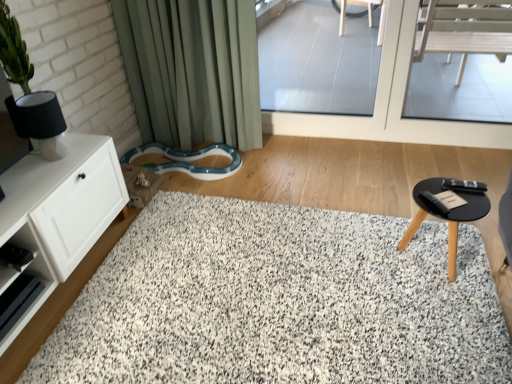
Question: Is white shaggy rug at center aimed at transparent glass door at upper center, the 2th window screen from the right?

Choices:
 (A) yes
 (B) no

Answer: (B)

Question: From the image's perspective, is white shaggy rug at center below transparent glass door at upper center, which appears as the 1th window screen when viewed from the left?

Choices:
 (A) no
 (B) yes

Answer: (B)

Question: Does white shaggy rug at center have a larger size compared to transparent glass door at upper center, the 2th window screen from the right?

Choices:
 (A) no
 (B) yes

Answer: (B)

Question: Can you confirm if white shaggy rug at center is shorter than transparent glass door at upper center, which appears as the 1th window screen when viewed from the left?

Choices:
 (A) yes
 (B) no

Answer: (A)

Question: Is transparent glass door at upper center, which appears as the 1th window screen when viewed from the left, inside white shaggy rug at center?

Choices:
 (A) no
 (B) yes

Answer: (A)

Question: In terms of size, does black matte table at lower right appear bigger or smaller than transparent glass window at center, which appears as the first window screen when viewed from the right?

Choices:
 (A) big
 (B) small

Answer: (B)

Question: From the image's perspective, is black matte table at lower right above or below transparent glass window at center, which appears as the first window screen when viewed from the right?

Choices:
 (A) above
 (B) below

Answer: (B)

Question: From their relative heights in the image, would you say black matte table at lower right is taller or shorter than transparent glass window at center, which appears as the first window screen when viewed from the right?

Choices:
 (A) tall
 (B) short

Answer: (B)

Question: Relative to transparent glass window at center, arranged as the 2th window screen when viewed from the left, is black matte table at lower right in front or behind?

Choices:
 (A) front
 (B) behind

Answer: (A)

Question: Is transparent glass door at upper center, the 2th window screen from the right, bigger or smaller than green fabric curtain at upper left?

Choices:
 (A) small
 (B) big

Answer: (A)

Question: Do you think transparent glass door at upper center, the 2th window screen from the right, is within green fabric curtain at upper left, or outside of it?

Choices:
 (A) outside
 (B) inside

Answer: (A)

Question: Based on their positions, is transparent glass door at upper center, the 2th window screen from the right, located to the left or right of green fabric curtain at upper left?

Choices:
 (A) left
 (B) right

Answer: (B)

Question: From the image's perspective, is transparent glass door at upper center, which appears as the 1th window screen when viewed from the left, located above or below green fabric curtain at upper left?

Choices:
 (A) above
 (B) below

Answer: (A)

Question: Is transparent glass window at center, which appears as the first window screen when viewed from the right, to the left or to the right of white matte cabinet at left in the image?

Choices:
 (A) left
 (B) right

Answer: (B)

Question: In terms of height, does transparent glass window at center, which appears as the first window screen when viewed from the right, look taller or shorter compared to white matte cabinet at left?

Choices:
 (A) short
 (B) tall

Answer: (B)